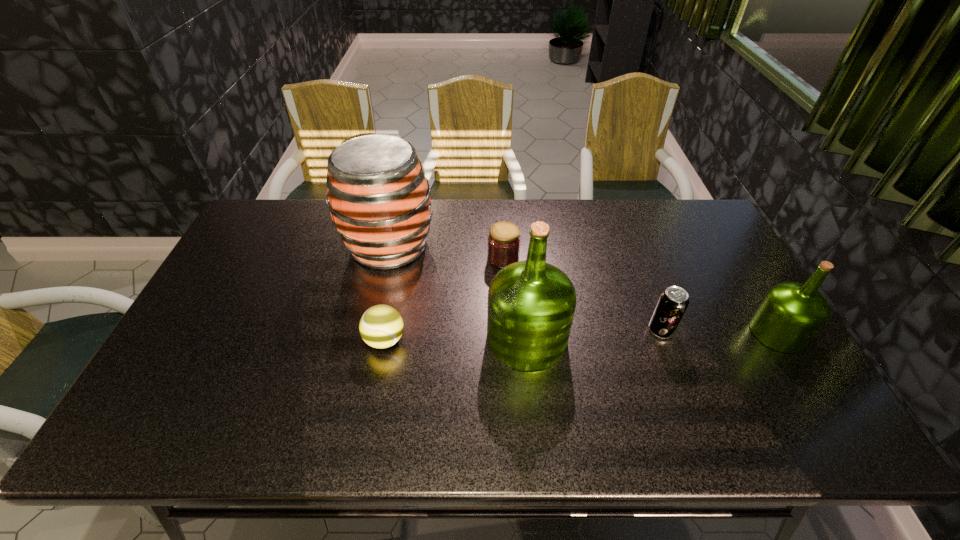
The height and width of the screenshot is (540, 960). I want to click on free space that is in between the taller olive oil and the cider, so click(x=458, y=292).

Locate which object is the fifth closest to the tennis ball. Please provide its 2D coordinates. Your answer should be formatted as a tuple, i.e. [(x, y)], where the tuple contains the x and y coordinates of a point satisfying the conditions above.

[(791, 314)]

Select which object is the second closest to the tennis ball. Please provide its 2D coordinates. Your answer should be formatted as a tuple, i.e. [(x, y)], where the tuple contains the x and y coordinates of a point satisfying the conditions above.

[(531, 304)]

You are a GUI agent. You are given a task and a screenshot of the screen. Output one action in this format:
    pyautogui.click(x=<x>, y=<y>)
    Task: Click on the free space that satisfies the following two spatial constraints: 1. on the front side of the jam; 2. on the right side of the cider
    This screenshot has width=960, height=540.
    Given the screenshot: What is the action you would take?
    pyautogui.click(x=387, y=258)

Locate an element on the screen. Image resolution: width=960 pixels, height=540 pixels. vacant position in the image that satisfies the following two spatial constraints: 1. on the front side of the jam; 2. on the left side of the fifth object from left to right is located at coordinates (507, 330).

At what (x,y) coordinates should I click in order to perform the action: click on free space in the image that satisfies the following two spatial constraints: 1. on the front side of the left olive oil; 2. on the left side of the cider. Please return your answer as a coordinate pair (x, y). The height and width of the screenshot is (540, 960). Looking at the image, I should click on (369, 338).